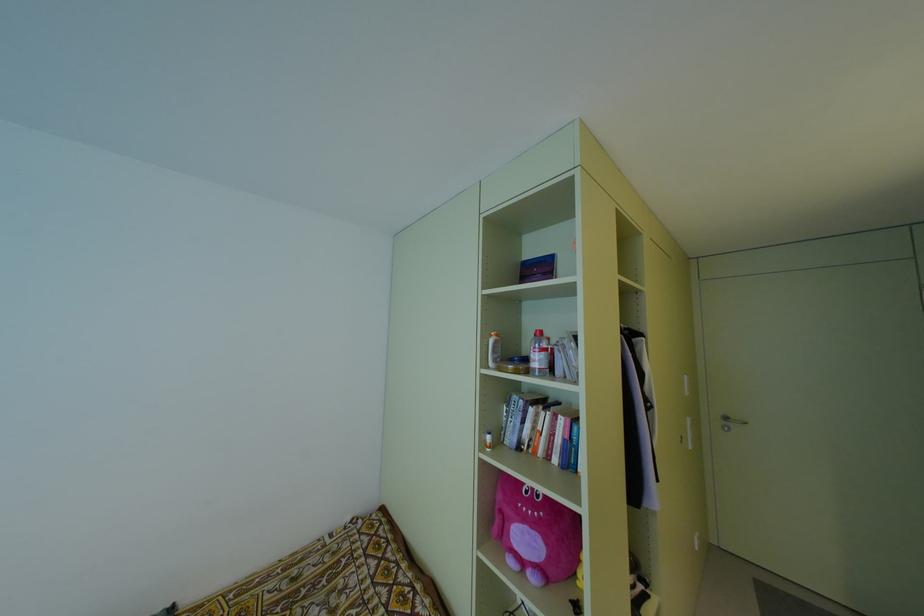
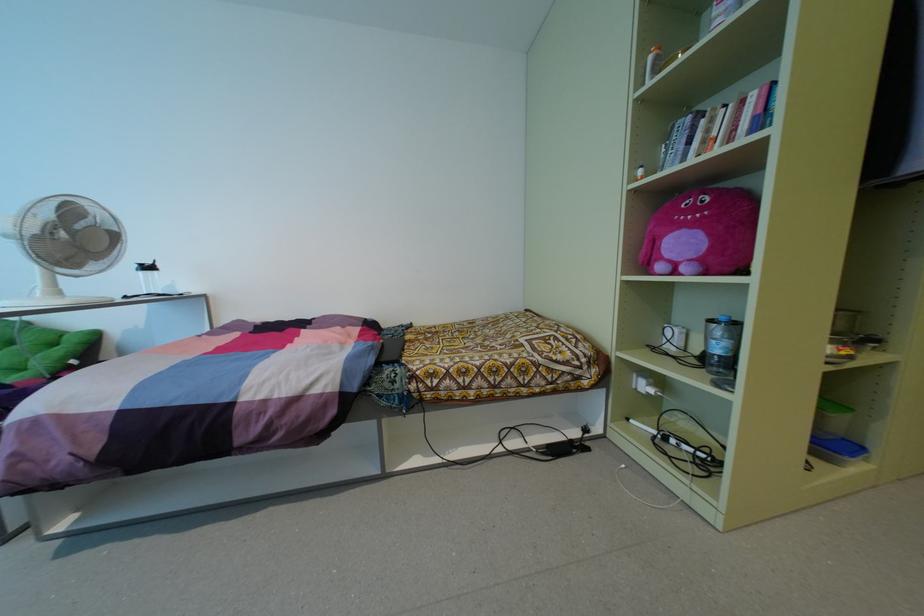
Locate, in the second image, the point that corresponds to pixel 491 339 in the first image.

(650, 57)